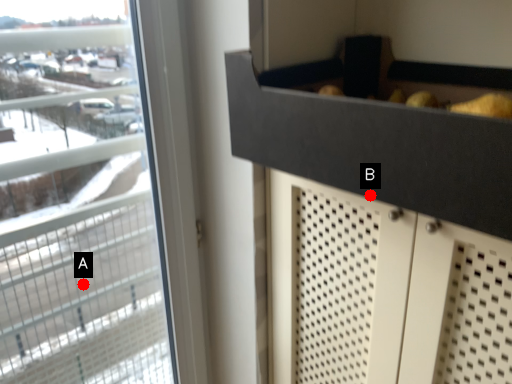
Question: Two points are circled on the image, labeled by A and B beside each circle. Which point is further to the camera?

Choices:
 (A) A is further
 (B) B is further

Answer: (A)